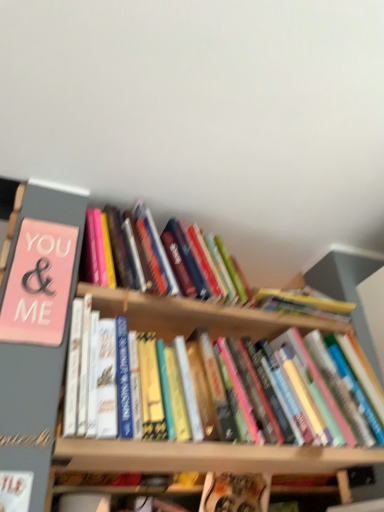
At what (x,y) coordinates should I click in order to perform the action: click on white paper at lower left, which is the 4th book from top to bottom. Please return your answer as a coordinate pair (x, y). Image resolution: width=384 pixels, height=512 pixels. Looking at the image, I should click on (15, 490).

The height and width of the screenshot is (512, 384). What do you see at coordinates (235, 493) in the screenshot?
I see `hardcover book at center, acting as the 5th book starting from the top` at bounding box center [235, 493].

Where is `hardcover book at center, the 3th book when ordered from bottom to top`? hardcover book at center, the 3th book when ordered from bottom to top is located at coordinates (257, 339).

Which object is further away from the camera taking this photo, hardcover book at center, which ranks as the 3th book in top-to-bottom order, or white paper at lower left, which ranks as the second book in bottom-to-top order?

hardcover book at center, which ranks as the 3th book in top-to-bottom order.

Does hardcover book at center, which ranks as the 3th book in top-to-bottom order, have a greater height compared to white paper at lower left, which ranks as the second book in bottom-to-top order?

Yes.

From the image's perspective, which one is positioned lower, hardcover book at center, the 3th book when ordered from bottom to top, or white paper at lower left, which ranks as the second book in bottom-to-top order?

white paper at lower left, which ranks as the second book in bottom-to-top order, appears lower in the image.

From the image's perspective, which one is positioned higher, white paper at lower left, which ranks as the second book in bottom-to-top order, or hardcover book at center, which ranks as the first book in bottom-to-top order?

white paper at lower left, which ranks as the second book in bottom-to-top order, from the image's perspective.

Is white paper at lower left, which ranks as the second book in bottom-to-top order, bigger than hardcover book at center, which ranks as the first book in bottom-to-top order?

Actually, white paper at lower left, which ranks as the second book in bottom-to-top order, might be smaller than hardcover book at center, which ranks as the first book in bottom-to-top order.

Is white paper at lower left, which ranks as the second book in bottom-to-top order, wider or thinner than hardcover book at center, which ranks as the first book in bottom-to-top order?

Considering their sizes, white paper at lower left, which ranks as the second book in bottom-to-top order, looks slimmer than hardcover book at center, which ranks as the first book in bottom-to-top order.

Is white paper at lower left, which ranks as the second book in bottom-to-top order, positioned in front of hardcover book at center, acting as the 5th book starting from the top?

Yes, white paper at lower left, which ranks as the second book in bottom-to-top order, is closer to the camera.

Looking at their sizes, would you say white paper at lower left, which is the 4th book from top to bottom, is wider or thinner than hardcover book at center, which ranks as the 3th book in top-to-bottom order?

white paper at lower left, which is the 4th book from top to bottom, is thinner than hardcover book at center, which ranks as the 3th book in top-to-bottom order.

Looking at this image, relative to hardcover book at center, the 3th book when ordered from bottom to top, is white paper at lower left, which ranks as the second book in bottom-to-top order, in front or behind?

white paper at lower left, which ranks as the second book in bottom-to-top order, is in front of hardcover book at center, the 3th book when ordered from bottom to top.

From a real-world perspective, between white paper at lower left, which ranks as the second book in bottom-to-top order, and hardcover book at center, the 3th book when ordered from bottom to top, who is vertically higher?

hardcover book at center, the 3th book when ordered from bottom to top.

Looking at the image, does white paper at lower left, which ranks as the second book in bottom-to-top order, seem bigger or smaller compared to hardcover book at center, which ranks as the 3th book in top-to-bottom order?

white paper at lower left, which ranks as the second book in bottom-to-top order, is smaller than hardcover book at center, which ranks as the 3th book in top-to-bottom order.

Considering the positions of objects pink matte sign at left, the fourth book when ordered from bottom to top, and hardcover book at center, acting as the 5th book starting from the top, in the image provided, who is in front, pink matte sign at left, the fourth book when ordered from bottom to top, or hardcover book at center, acting as the 5th book starting from the top,?

pink matte sign at left, the fourth book when ordered from bottom to top.

Which is behind, point (59, 288) or point (240, 477)?

The point (240, 477) is more distant.

Could you measure the distance between pink matte sign at left, the fourth book when ordered from bottom to top, and hardcover book at center, which ranks as the first book in bottom-to-top order?

1.29 meters.

Is hardcover book at center, acting as the 5th book starting from the top, not near hardcover book at center, the 3th book when ordered from bottom to top?

hardcover book at center, acting as the 5th book starting from the top, is actually quite close to hardcover book at center, the 3th book when ordered from bottom to top.

From a real-world perspective, who is located lower, hardcover book at center, acting as the 5th book starting from the top, or hardcover book at center, the 3th book when ordered from bottom to top?

In real-world perspective, hardcover book at center, acting as the 5th book starting from the top, is lower.

Which is in front, point (265, 489) or point (121, 296)?

The point (121, 296) is in front.

Is hardcover book at center, acting as the 5th book starting from the top, positioned with its back to hardcover book at center, the 3th book when ordered from bottom to top?

No, hardcover book at center, acting as the 5th book starting from the top, is not facing the opposite direction of hardcover book at center, the 3th book when ordered from bottom to top.

In order to click on the 1st book behind the hardcover book at center, the 3th book when ordered from bottom to top, starting your count from the anchor in this screenshot , I will do `click(39, 284)`.

Is pink matte sign at left, the 2th book positioned from the top, completely or partially outside of hardcover book at center, which ranks as the 3th book in top-to-bottom order?

Yes, pink matte sign at left, the 2th book positioned from the top, is not within hardcover book at center, which ranks as the 3th book in top-to-bottom order.

Based on their positions, is pink matte sign at left, the fourth book when ordered from bottom to top, located to the left or right of hardcover book at center, which ranks as the 3th book in top-to-bottom order?

In the image, pink matte sign at left, the fourth book when ordered from bottom to top, appears on the left side of hardcover book at center, which ranks as the 3th book in top-to-bottom order.

Is hardcover book at center, which ranks as the 3th book in top-to-bottom order, at the back of pink matte sign at left, the 2th book positioned from the top?

pink matte sign at left, the 2th book positioned from the top, does not have its back to hardcover book at center, which ranks as the 3th book in top-to-bottom order.

From a real-world perspective, who is located lower, hardcover book at center, which is counted as the 5th book, starting from the bottom, or pink matte sign at left, the 2th book positioned from the top?

pink matte sign at left, the 2th book positioned from the top, from a real-world perspective.

Can you see hardcover book at center, which is counted as the 5th book, starting from the bottom, touching pink matte sign at left, the 2th book positioned from the top?

hardcover book at center, which is counted as the 5th book, starting from the bottom, and pink matte sign at left, the 2th book positioned from the top, are not in contact.

Can you confirm if hardcover book at center, marked as the 1th book in a top-to-bottom arrangement, is thinner than pink matte sign at left, the fourth book when ordered from bottom to top?

In fact, hardcover book at center, marked as the 1th book in a top-to-bottom arrangement, might be wider than pink matte sign at left, the fourth book when ordered from bottom to top.

This screenshot has height=512, width=384. I want to click on book in front of the hardcover book at center, the 3th book when ordered from bottom to top, so click(x=15, y=490).

At what (x,y) coordinates should I click in order to perform the action: click on book that is the 3rd one when counting rightward from the white paper at lower left, which is the 4th book from top to bottom. Please return your answer as a coordinate pair (x, y). Looking at the image, I should click on (235, 493).

Based on their spatial positions, is hardcover book at center, marked as the 1th book in a top-to-bottom arrangement, or pink matte sign at left, the fourth book when ordered from bottom to top, closer to hardcover book at center, which ranks as the 3th book in top-to-bottom order?

Among the two, hardcover book at center, marked as the 1th book in a top-to-bottom arrangement, is located nearer to hardcover book at center, which ranks as the 3th book in top-to-bottom order.

When comparing their distances from hardcover book at center, acting as the 5th book starting from the top, does white paper at lower left, which ranks as the second book in bottom-to-top order, or hardcover book at center, marked as the 1th book in a top-to-bottom arrangement, seem closer?

Based on the image, hardcover book at center, marked as the 1th book in a top-to-bottom arrangement, appears to be nearer to hardcover book at center, acting as the 5th book starting from the top.

From the image, which object appears to be nearer to pink matte sign at left, the fourth book when ordered from bottom to top, hardcover book at center, which ranks as the first book in bottom-to-top order, or hardcover book at center, the 3th book when ordered from bottom to top?

hardcover book at center, the 3th book when ordered from bottom to top, is positioned closer to the anchor pink matte sign at left, the fourth book when ordered from bottom to top.

From the image, which object appears to be nearer to white paper at lower left, which ranks as the second book in bottom-to-top order, hardcover book at center, which ranks as the 3th book in top-to-bottom order, or hardcover book at center, which ranks as the first book in bottom-to-top order?

hardcover book at center, which ranks as the 3th book in top-to-bottom order.

Considering their positions, is pink matte sign at left, the 2th book positioned from the top, positioned further to white paper at lower left, which is the 4th book from top to bottom, than hardcover book at center, marked as the 1th book in a top-to-bottom arrangement?

Among the two, hardcover book at center, marked as the 1th book in a top-to-bottom arrangement, is located further to white paper at lower left, which is the 4th book from top to bottom.

Based on their spatial positions, is pink matte sign at left, the fourth book when ordered from bottom to top, or hardcover book at center, acting as the 5th book starting from the top, further from white paper at lower left, which is the 4th book from top to bottom?

Based on the image, hardcover book at center, acting as the 5th book starting from the top, appears to be further to white paper at lower left, which is the 4th book from top to bottom.

Which object lies nearer to the anchor point hardcover book at center, acting as the 5th book starting from the top, hardcover book at center, the 3th book when ordered from bottom to top, or pink matte sign at left, the fourth book when ordered from bottom to top?

hardcover book at center, the 3th book when ordered from bottom to top, is closer to hardcover book at center, acting as the 5th book starting from the top.

Based on their spatial positions, is hardcover book at center, which ranks as the 3th book in top-to-bottom order, or hardcover book at center, which is counted as the 5th book, starting from the bottom, further from hardcover book at center, which ranks as the first book in bottom-to-top order?

hardcover book at center, which is counted as the 5th book, starting from the bottom, is positioned further to the anchor hardcover book at center, which ranks as the first book in bottom-to-top order.

The height and width of the screenshot is (512, 384). What are the coordinates of `book between pink matte sign at left, the fourth book when ordered from bottom to top, and hardcover book at center, which is counted as the 5th book, starting from the bottom, from left to right` in the screenshot? It's located at (15, 490).

Where is `book between white paper at lower left, which is the 4th book from top to bottom, and hardcover book at center, which ranks as the 3th book in top-to-bottom order, in the horizontal direction`? Image resolution: width=384 pixels, height=512 pixels. book between white paper at lower left, which is the 4th book from top to bottom, and hardcover book at center, which ranks as the 3th book in top-to-bottom order, in the horizontal direction is located at coordinates (277, 294).